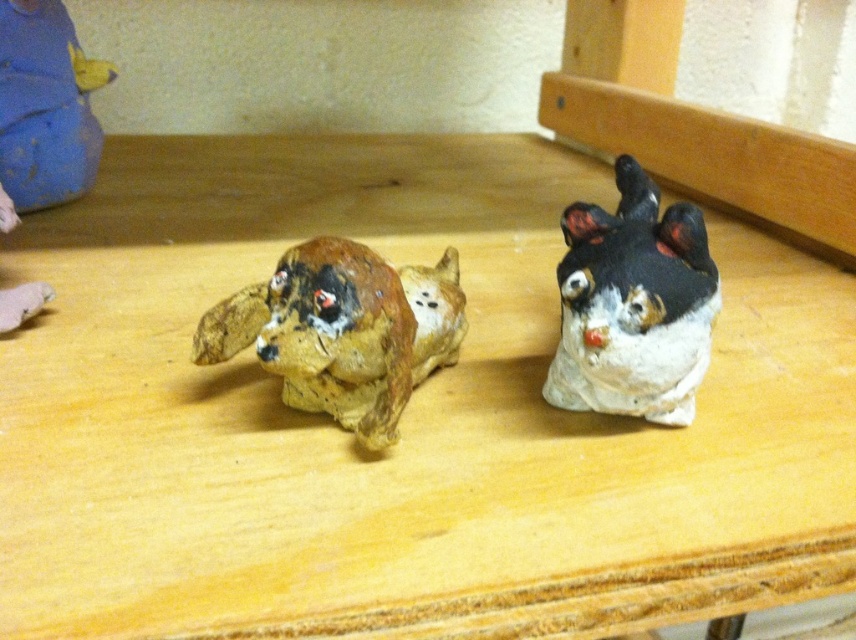
Question: Considering the relative positions of speckled clay cat at right and matte blue plush at upper left in the image provided, where is speckled clay cat at right located with respect to matte blue plush at upper left?

Choices:
 (A) right
 (B) left

Answer: (A)

Question: Among these points, which one is farthest from the camera?

Choices:
 (A) (675, 221)
 (B) (379, 355)
 (C) (0, 68)

Answer: (C)

Question: Which point is farther to the camera?

Choices:
 (A) (28, 74)
 (B) (615, 307)
 (C) (299, 300)

Answer: (A)

Question: Is speckled clay cat at right above matte blue plush at upper left?

Choices:
 (A) yes
 (B) no

Answer: (B)

Question: Can you confirm if brown matte dog at left is positioned below matte blue plush at upper left?

Choices:
 (A) no
 (B) yes

Answer: (B)

Question: Which object is closer to the camera taking this photo?

Choices:
 (A) brown matte dog at left
 (B) matte blue plush at upper left

Answer: (A)